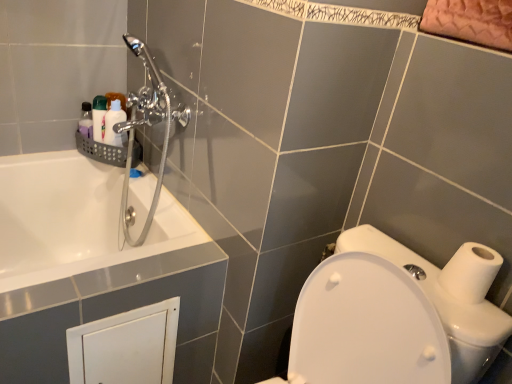
Image resolution: width=512 pixels, height=384 pixels. I want to click on unoccupied space behind white matte toilet paper at right, so click(409, 249).